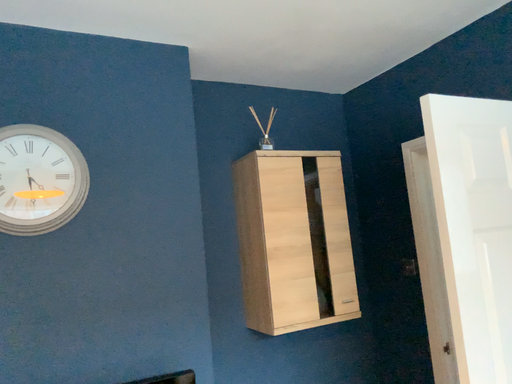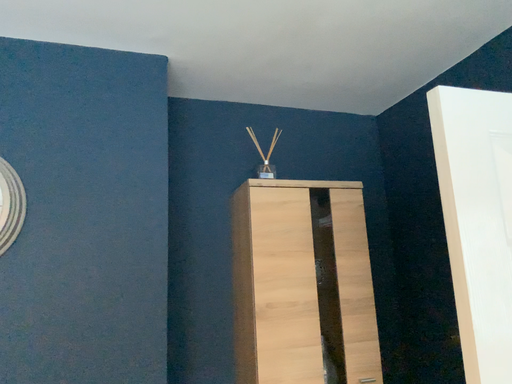
Question: Which way did the camera rotate in the video?

Choices:
 (A) rotated left
 (B) rotated right

Answer: (A)